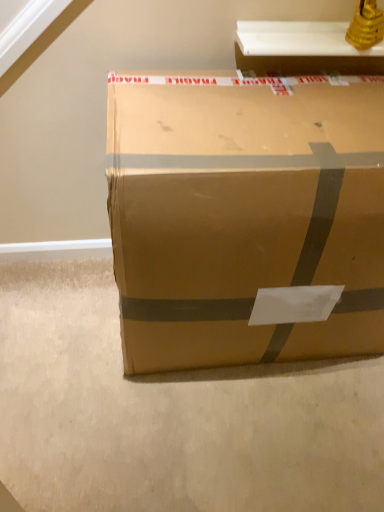
The width and height of the screenshot is (384, 512). Identify the location of white glossy shelf at upper center. click(x=302, y=49).

The width and height of the screenshot is (384, 512). Describe the element at coordinates (302, 49) in the screenshot. I see `white glossy shelf at upper center` at that location.

Identify the location of brown cardboard box at center. (243, 216).

This screenshot has height=512, width=384. Describe the element at coordinates (243, 216) in the screenshot. I see `brown cardboard box at center` at that location.

Locate an element on the screen. white glossy shelf at upper center is located at coordinates (302, 49).

Does white glossy shelf at upper center appear on the right side of brown cardboard box at center?

Correct, you'll find white glossy shelf at upper center to the right of brown cardboard box at center.

Is the position of white glossy shelf at upper center less distant than that of brown cardboard box at center?

No, the depth of white glossy shelf at upper center is greater than that of brown cardboard box at center.

Which is in front, point (250, 50) or point (274, 238)?

The point (274, 238) is more forward.

From the image's perspective, is white glossy shelf at upper center on brown cardboard box at center?

Yes, from the image's perspective, white glossy shelf at upper center is over brown cardboard box at center.

From a real-world perspective, who is located higher, white glossy shelf at upper center or brown cardboard box at center?

From a 3D spatial view, white glossy shelf at upper center is above.

Is white glossy shelf at upper center thinner than brown cardboard box at center?

Yes, white glossy shelf at upper center is thinner than brown cardboard box at center.

Considering the sizes of white glossy shelf at upper center and brown cardboard box at center in the image, is white glossy shelf at upper center taller or shorter than brown cardboard box at center?

Considering their sizes, white glossy shelf at upper center has less height than brown cardboard box at center.

Can you confirm if white glossy shelf at upper center is smaller than brown cardboard box at center?

Yes.

Is white glossy shelf at upper center spatially inside brown cardboard box at center, or outside of it?

white glossy shelf at upper center cannot be found inside brown cardboard box at center.

Can you see white glossy shelf at upper center touching brown cardboard box at center?

No, white glossy shelf at upper center is not touching brown cardboard box at center.

In the scene shown: Is white glossy shelf at upper center positioned with its back to brown cardboard box at center?

That's not correct — white glossy shelf at upper center is not looking away from brown cardboard box at center.

Can you tell me how much white glossy shelf at upper center and brown cardboard box at center differ in facing direction?

The angular difference between white glossy shelf at upper center and brown cardboard box at center is 1.2 degrees.

Identify the location of box to the left of white glossy shelf at upper center. The height and width of the screenshot is (512, 384). (243, 216).

Is brown cardboard box at center to the left or to the right of white glossy shelf at upper center in the image?

Based on their positions, brown cardboard box at center is located to the left of white glossy shelf at upper center.

Which object is further away from the camera, brown cardboard box at center or white glossy shelf at upper center?

white glossy shelf at upper center is more distant.

Considering the points (205, 209) and (344, 50), which point is in front, point (205, 209) or point (344, 50)?

The point (205, 209) is in front.

From the image's perspective, between brown cardboard box at center and white glossy shelf at upper center, who is located below?

brown cardboard box at center is shown below in the image.

From a real-world perspective, is brown cardboard box at center positioned over white glossy shelf at upper center based on gravity?

No, from a real-world perspective, brown cardboard box at center is not on top of white glossy shelf at upper center.

In the scene shown: Considering the sizes of brown cardboard box at center and white glossy shelf at upper center in the image, is brown cardboard box at center wider or thinner than white glossy shelf at upper center?

brown cardboard box at center is wider than white glossy shelf at upper center.

Which of these two, brown cardboard box at center or white glossy shelf at upper center, stands shorter?

white glossy shelf at upper center.

Which of these two, brown cardboard box at center or white glossy shelf at upper center, is smaller?

With smaller size is white glossy shelf at upper center.

Is brown cardboard box at center situated inside white glossy shelf at upper center or outside?

brown cardboard box at center exists outside the volume of white glossy shelf at upper center.

Can you see brown cardboard box at center touching white glossy shelf at upper center?

No, brown cardboard box at center is not next to white glossy shelf at upper center.

Is brown cardboard box at center looking in the opposite direction of white glossy shelf at upper center?

No, brown cardboard box at center is not facing the opposite direction of white glossy shelf at upper center.

How different are the orientations of brown cardboard box at center and white glossy shelf at upper center in degrees?

The angle between the facing direction of brown cardboard box at center and the facing direction of white glossy shelf at upper center is 1.2 degrees.

Image resolution: width=384 pixels, height=512 pixels. Identify the location of table to the right of brown cardboard box at center. (302, 49).

Locate an element on the screen. This screenshot has height=512, width=384. box on the left side of white glossy shelf at upper center is located at coordinates (243, 216).

Identify the location of box below the white glossy shelf at upper center (from a real-world perspective). 243,216.